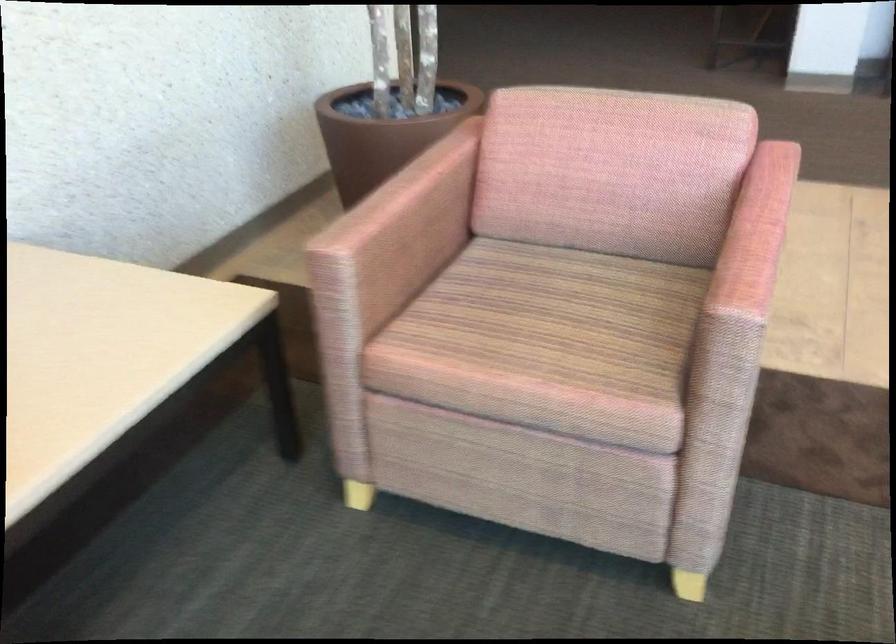
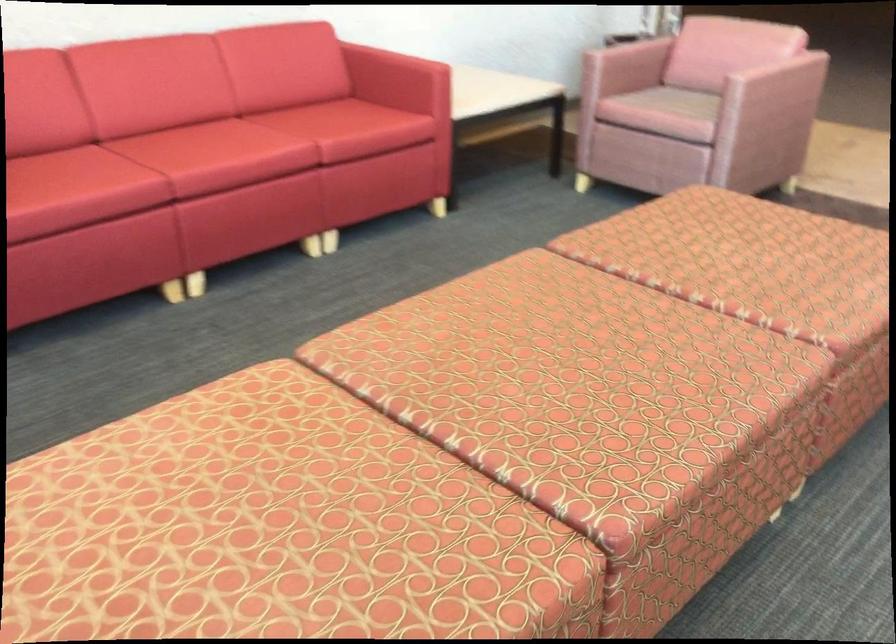
Find the pixel in the second image that matches pixel 409 220 in the first image.

(627, 58)